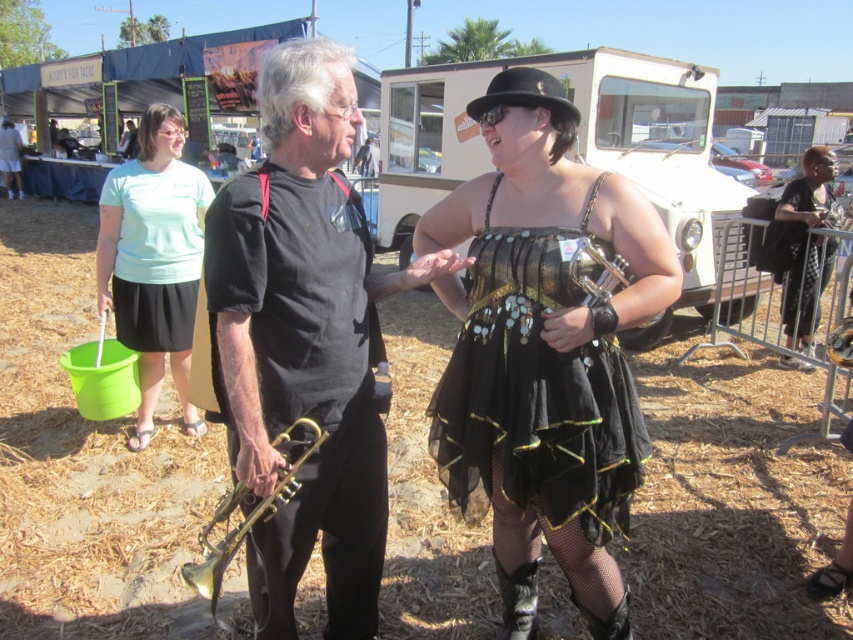
Question: Is gold brass trumpet at center bigger than black sequined dress at right?

Choices:
 (A) no
 (B) yes

Answer: (B)

Question: Which object is the closest to the gold shiny trumpet at center?

Choices:
 (A) shiny gold trumpet at center
 (B) black sequined dress at right

Answer: (A)

Question: Based on their relative distances, which object is nearer to the black sequined dress at center?

Choices:
 (A) gold shiny trumpet at center
 (B) gold brass trumpet at center
 (C) shiny gold trumpet at center

Answer: (C)

Question: Is black sequined dress at center behind light blue cotton shirt at upper left?

Choices:
 (A) yes
 (B) no

Answer: (B)

Question: Can you confirm if shiny gold trumpet at center is thinner than gold shiny trumpet at center?

Choices:
 (A) yes
 (B) no

Answer: (B)

Question: Which of the following is the closest to the observer?

Choices:
 (A) black sequined dress at right
 (B) shiny gold trumpet at center
 (C) gold brass trumpet at center

Answer: (C)